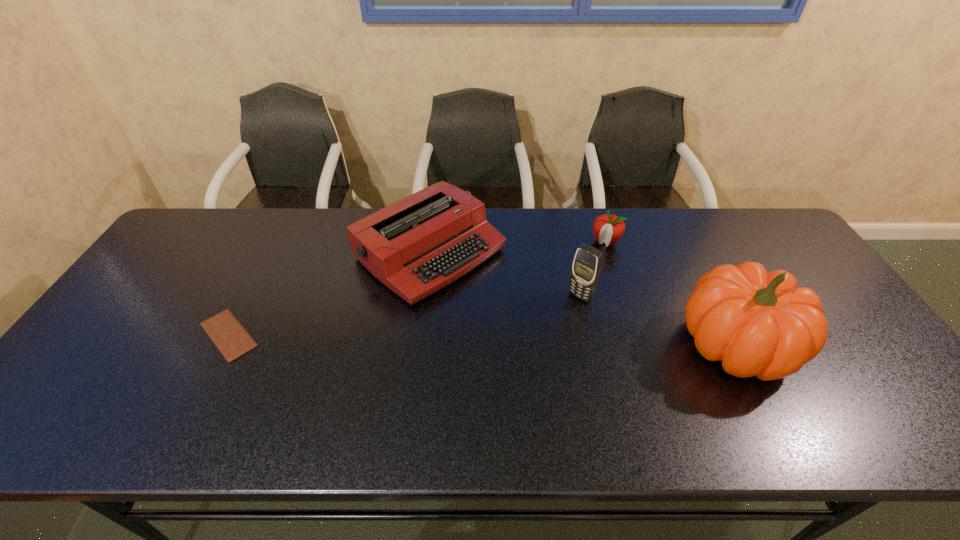
I want to click on vacant space on the desktop that is between the shortest object and the rightmost object and is positioned on the side where a bite is taken out of the fourth object from left to right, so click(x=541, y=341).

Find the location of a particular element. The image size is (960, 540). free space on the desktop that is between the shortest object and the tallest object and is positioned on the typing side of the second object from left to right is located at coordinates (546, 341).

I want to click on vacant spot on the desktop that is between the chocolate bar and the tallest object and is positioned on the front face of the third object from left to right, so click(x=538, y=340).